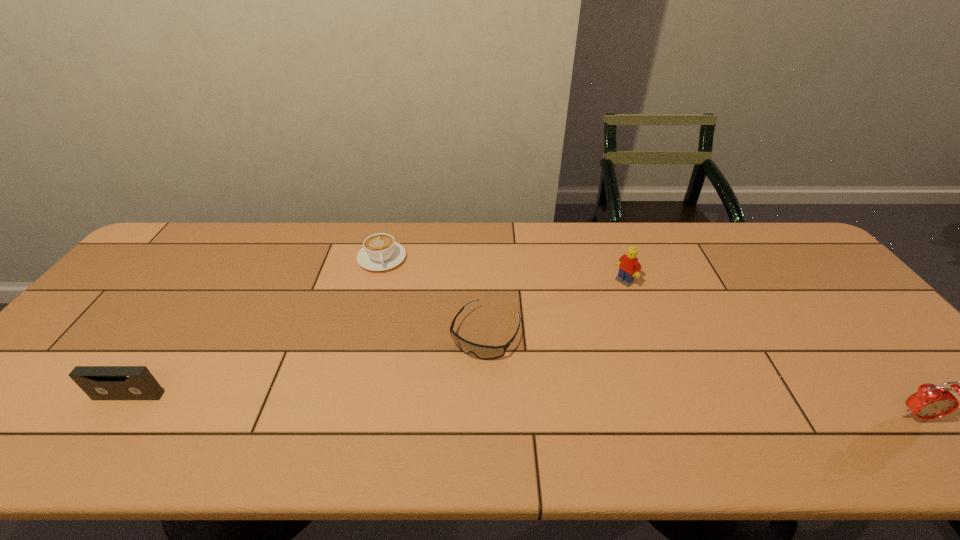
Where is `object located at the near right corner`? object located at the near right corner is located at coordinates pyautogui.click(x=930, y=402).

Where is `vacant area at the far edge of the desktop`? This screenshot has height=540, width=960. vacant area at the far edge of the desktop is located at coordinates (652, 227).

I want to click on free region at the near edge of the desktop, so click(376, 411).

In the image, there is a desktop. Find the location of `free space at the left edge`. free space at the left edge is located at coordinates (98, 356).

Where is `free region at the right edge of the desktop`? free region at the right edge of the desktop is located at coordinates (836, 327).

Locate an element on the screen. free space that is in between the Lego and the leftmost object is located at coordinates (376, 339).

The width and height of the screenshot is (960, 540). Find the location of `unoccupied position between the goggles and the nearest object`. unoccupied position between the goggles and the nearest object is located at coordinates (701, 375).

Where is `free area in between the third object from left to right and the third shortest object`? free area in between the third object from left to right and the third shortest object is located at coordinates (307, 364).

Locate an element on the screen. free spot between the third farthest object and the cappuccino is located at coordinates (x=434, y=296).

Find the location of `free spot between the leftmost object and the goggles`. free spot between the leftmost object and the goggles is located at coordinates (307, 364).